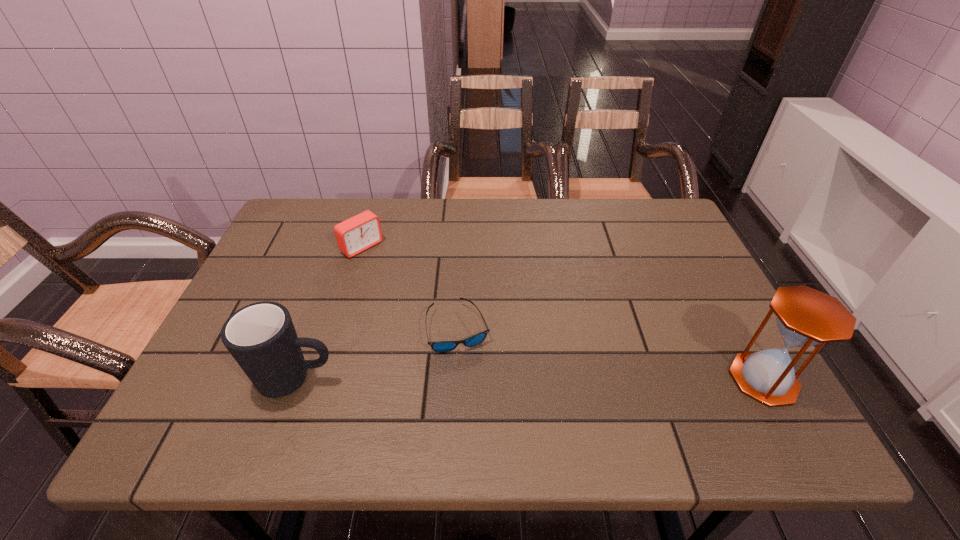
Where is `vacant area that lies between the rightmost object and the mug`? vacant area that lies between the rightmost object and the mug is located at coordinates (530, 380).

Find the location of a particular element. This screenshot has height=540, width=960. unoccupied area between the mug and the third object from left to right is located at coordinates (377, 354).

The image size is (960, 540). I want to click on vacant space in between the tallest object and the second object from right to left, so click(611, 354).

Identify the location of free space between the second shortest object and the sunglasses. Image resolution: width=960 pixels, height=540 pixels. (410, 288).

The width and height of the screenshot is (960, 540). Find the location of `vacant area between the tallest object and the third tallest object`. vacant area between the tallest object and the third tallest object is located at coordinates (563, 313).

In order to click on free space between the second tallest object and the rightmost object in this screenshot , I will do `click(530, 380)`.

You are a GUI agent. You are given a task and a screenshot of the screen. Output one action in this format:
    pyautogui.click(x=<x>, y=<y>)
    Task: Click on the unoccupied position between the second tallest object and the rightmost object
    The image size is (960, 540).
    Given the screenshot: What is the action you would take?
    pyautogui.click(x=530, y=380)

This screenshot has height=540, width=960. In order to click on vacant space that is in between the alarm clock and the mug in this screenshot , I will do `click(329, 313)`.

Find the location of `object that is the third closest one to the third object from left to right`. object that is the third closest one to the third object from left to right is located at coordinates (806, 317).

Image resolution: width=960 pixels, height=540 pixels. I want to click on object that is the nearest to the third object from left to right, so click(x=261, y=337).